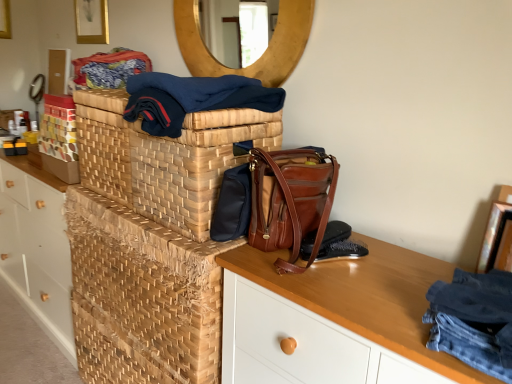
Question: From a real-world perspective, is wooden circular mirror at upper center over woven wood basket at center?

Choices:
 (A) no
 (B) yes

Answer: (B)

Question: Is the position of wooden circular mirror at upper center less distant than that of woven wood basket at center?

Choices:
 (A) yes
 (B) no

Answer: (B)

Question: Is wooden circular mirror at upper center to the right of woven wood basket at center from the viewer's perspective?

Choices:
 (A) no
 (B) yes

Answer: (B)

Question: Considering the relative sizes of wooden circular mirror at upper center and woven wood basket at center in the image provided, is wooden circular mirror at upper center bigger than woven wood basket at center?

Choices:
 (A) yes
 (B) no

Answer: (B)

Question: Considering the relative sizes of wooden circular mirror at upper center and woven wood basket at center in the image provided, is wooden circular mirror at upper center smaller than woven wood basket at center?

Choices:
 (A) no
 (B) yes

Answer: (B)

Question: Looking at the image, does wooden circular mirror at upper center seem bigger or smaller compared to wooden desk at center?

Choices:
 (A) small
 (B) big

Answer: (A)

Question: From the image's perspective, is wooden circular mirror at upper center positioned above or below wooden desk at center?

Choices:
 (A) below
 (B) above

Answer: (B)

Question: Is wooden circular mirror at upper center to the left or to the right of wooden desk at center in the image?

Choices:
 (A) left
 (B) right

Answer: (A)

Question: Considering their positions, is wooden circular mirror at upper center located in front of or behind wooden desk at center?

Choices:
 (A) front
 (B) behind

Answer: (B)

Question: From a real-world perspective, is denim jeans at right, the 2th clothing in the left-to-right sequence, physically located above or below woven wood basket at center?

Choices:
 (A) above
 (B) below

Answer: (A)

Question: From the image's perspective, is denim jeans at right, the second clothing in the back-to-front sequence, positioned above or below woven wood basket at center?

Choices:
 (A) above
 (B) below

Answer: (A)

Question: Would you say denim jeans at right, which is counted as the 1th clothing, starting from the bottom, is inside or outside woven wood basket at center?

Choices:
 (A) outside
 (B) inside

Answer: (A)

Question: Is point 443,340 positioned closer to the camera than point 179,347?

Choices:
 (A) closer
 (B) farther

Answer: (A)

Question: From a real-world perspective, is black leather shoe at lower right, acting as the first shoe starting from the top, positioned above or below shiny brown leather messenger bag at center?

Choices:
 (A) above
 (B) below

Answer: (B)

Question: In terms of height, does black leather shoe at lower right, acting as the first shoe starting from the top, look taller or shorter compared to shiny brown leather messenger bag at center?

Choices:
 (A) short
 (B) tall

Answer: (A)